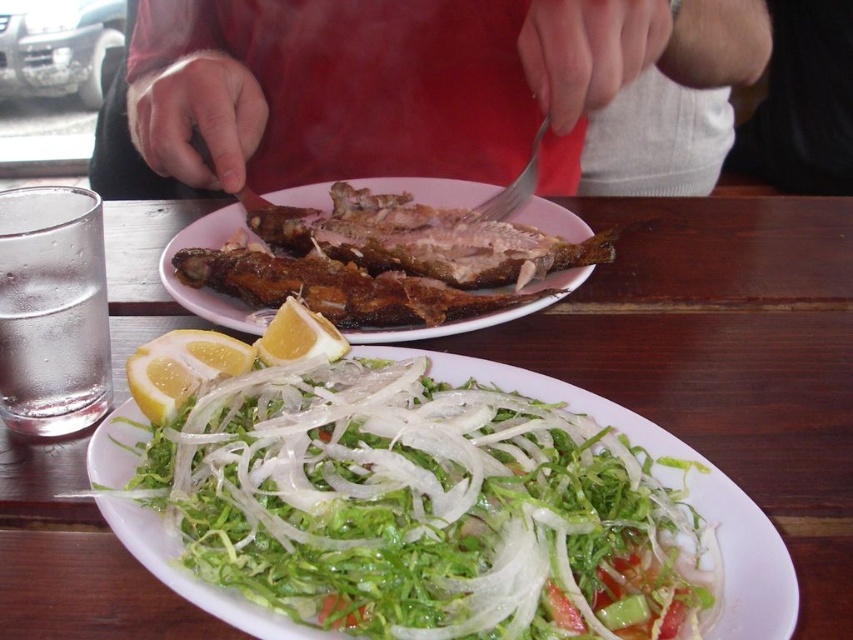
You are a photographer trying to capture the best angle of the meal. You notice two points in the image at coordinates point (534, 410) and point (263, 332). Which point should you focus on to ensure it appears larger in your photo?

Point (534, 410) is closer to the camera than point (263, 332), so focusing on point (534, 410) will make it appear larger in the photo.

You are a food stylist arranging a photo shoot. You have a translucent white shredded vegetable at lower center and a yellow matte lemon at center. Which item is placed to the right of the other?

The translucent white shredded vegetable at lower center is positioned on the right side of yellow matte lemon at center.

In the scene shown: You are a diner who just sat down at the wooden table at center and need to reach for the silver metallic fork at upper center. Can you tell me which direction you should move your hand to grab it?

The wooden table at center is positioned on the left side of the silver metallic fork at upper center, so you should move your hand to the right to reach the silver metallic fork at upper center.